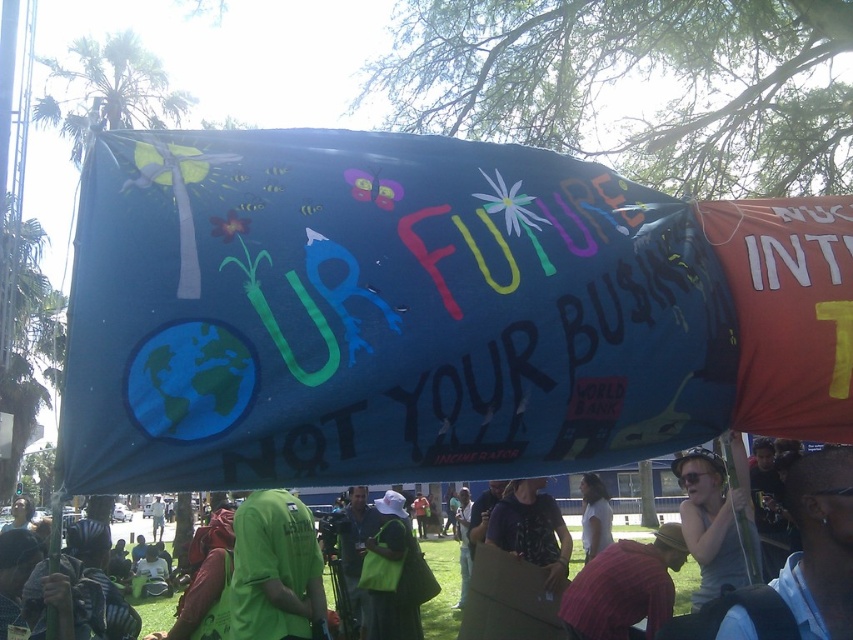
Question: Estimate the real-world distances between objects in this image. Which object is farther from the green fabric shirt at lower left?

Choices:
 (A) plaid shirt at lower center
 (B) green t-shirt at center

Answer: (B)

Question: Is plaid shirt at lower center bigger than matte gray tank top at center?

Choices:
 (A) no
 (B) yes

Answer: (A)

Question: Which object is the closest to the matte black shirt at center?

Choices:
 (A) plaid shirt at lower center
 (B) green t-shirt at center
 (C) matte gray tank top at center
 (D) green fabric shirt at lower left

Answer: (A)

Question: Which of the following is the closest to the observer?

Choices:
 (A) (670, 588)
 (B) (503, 540)

Answer: (A)

Question: Can you confirm if matte gray tank top at center is positioned to the left of white fabric at center?

Choices:
 (A) no
 (B) yes

Answer: (B)

Question: From the image, what is the correct spatial relationship of matte gray tank top at center in relation to matte black shirt at center?

Choices:
 (A) left
 (B) right

Answer: (B)